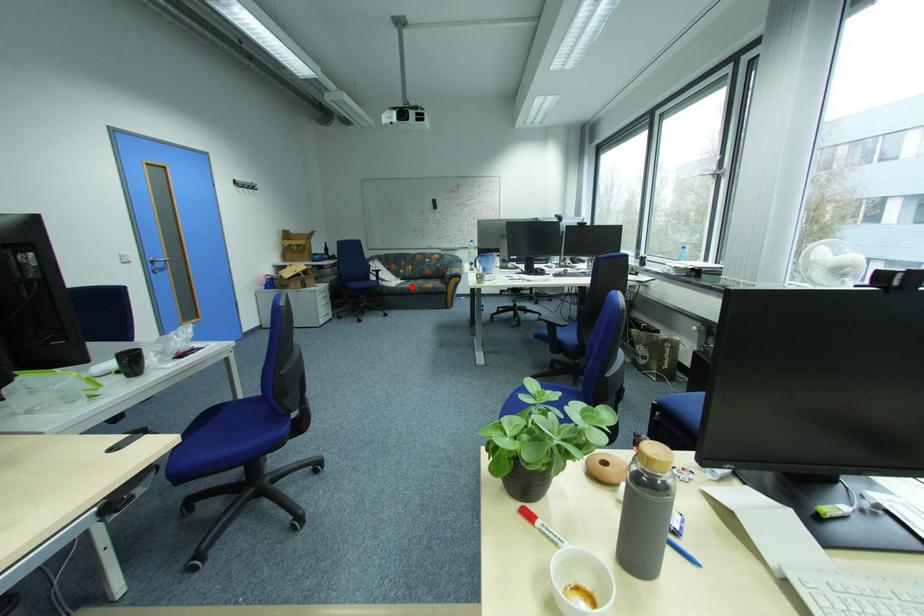
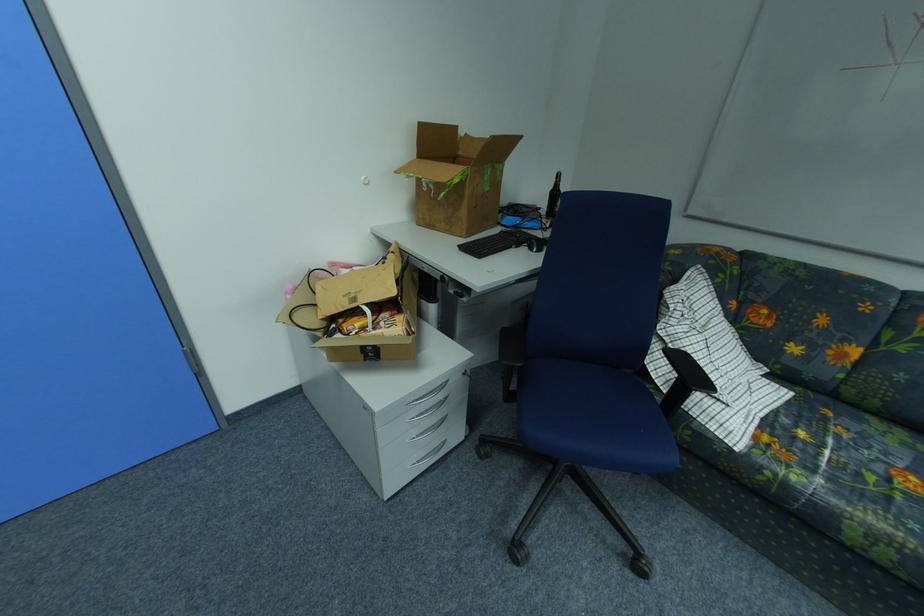
Where in the second image is the point corresponding to the highlighted location from the first image?

(804, 479)